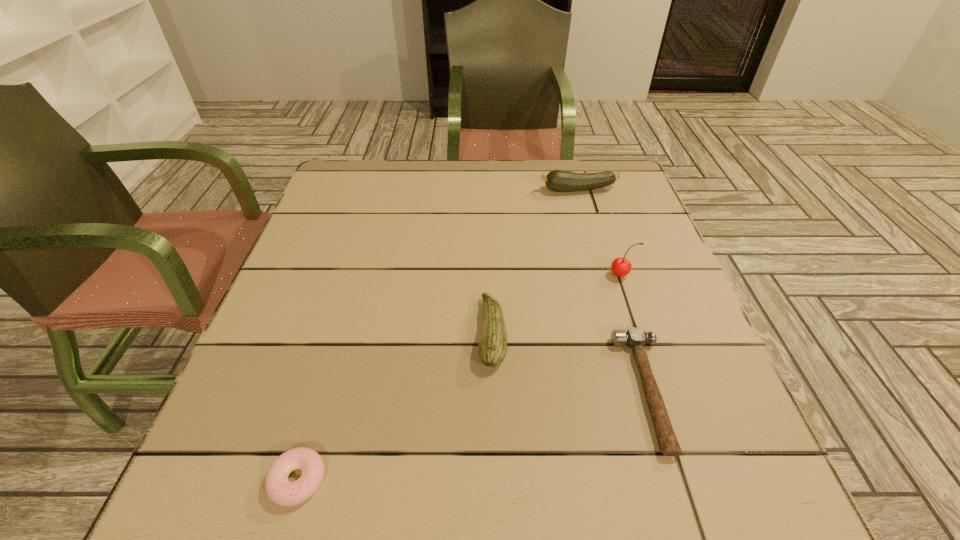
This screenshot has height=540, width=960. In order to click on the tallest object in this screenshot , I will do [621, 267].

Identify the location of the second farthest object. (621, 267).

The width and height of the screenshot is (960, 540). Identify the location of the farther zucchini. (557, 180).

Locate an element on the screen. the right zucchini is located at coordinates (557, 180).

Find the location of `the fourth object from right to left`. the fourth object from right to left is located at coordinates (492, 348).

At what (x,y) coordinates should I click in order to perform the action: click on the nearer zucchini. Please return your answer as a coordinate pair (x, y). Looking at the image, I should click on (492, 348).

This screenshot has height=540, width=960. Identify the location of hammer. (635, 338).

The width and height of the screenshot is (960, 540). I want to click on the leftmost object, so click(282, 492).

Locate an element on the screen. The image size is (960, 540). vacant space located on the back of the tallest object is located at coordinates (597, 200).

Locate an element on the screen. vacant space located at the blossom end of the right zucchini is located at coordinates (491, 190).